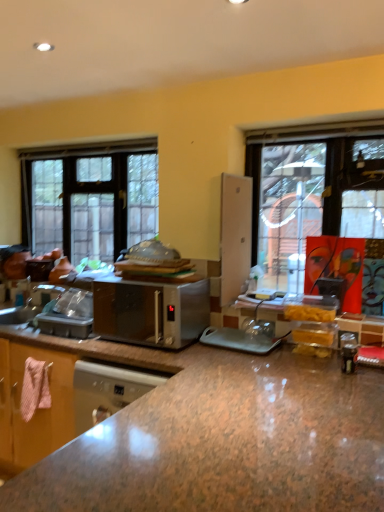
Locate an element on the screen. The image size is (384, 512). clear glass window at left is located at coordinates (90, 197).

From a real-world perspective, is clear glass window at left physically below satin silver microwave at center?

No.

From the image's perspective, is clear glass window at left below satin silver microwave at center?

No.

Is clear glass window at left positioned far away from satin silver microwave at center?

Yes, clear glass window at left and satin silver microwave at center are quite far apart.

Can you tell me how much satin silver microwave at center and clear glass window at left differ in facing direction?

The angle between the facing direction of satin silver microwave at center and the facing direction of clear glass window at left is 1.95 degrees.

Are satin silver microwave at center and clear glass window at left making contact?

There is a gap between satin silver microwave at center and clear glass window at left.

Consider the image. Which is in front, satin silver microwave at center or clear glass window at left?

satin silver microwave at center is closer to the camera.

From a real-world perspective, is satin silver microwave at center physically below clear glass window at left?

Indeed, from a real-world perspective, satin silver microwave at center is positioned beneath clear glass window at left.

Considering the positions of point (334, 436) and point (122, 231), is point (334, 436) closer or farther from the camera than point (122, 231)?

Clearly, point (334, 436) is closer to the camera than point (122, 231).

This screenshot has width=384, height=512. I want to click on countertop on the right of clear glass window at left, so click(218, 436).

Would you say brown granite countertop at center is a long distance from clear glass window at left?

Yes, brown granite countertop at center is far from clear glass window at left.

Considering the sizes of brown granite countertop at center and clear glass window at left in the image, is brown granite countertop at center wider or thinner than clear glass window at left?

In the image, brown granite countertop at center appears to be wider than clear glass window at left.

Does clear glass window at left lie behind brown granite countertop at center?

Yes, it is behind brown granite countertop at center.

Consider the image. From a real-world perspective, is clear glass window at left positioned over brown granite countertop at center based on gravity?

Yes, from a real-world perspective, clear glass window at left is over brown granite countertop at center

Consider the image. Can brown granite countertop at center be found inside clear glass window at left?

No.

Is clear glass window at left positioned with its back to brown granite countertop at center?

clear glass window at left does not have its back to brown granite countertop at center.

Between satin silver microwave at center and brown granite countertop at center, which one has larger width?

With larger width is brown granite countertop at center.

Are satin silver microwave at center and brown granite countertop at center far apart?

satin silver microwave at center is actually quite close to brown granite countertop at center.

Is satin silver microwave at center at the right side of brown granite countertop at center?

In fact, satin silver microwave at center is to the left of brown granite countertop at center.

Is brown granite countertop at center inside satin silver microwave at center?

No, brown granite countertop at center is not inside satin silver microwave at center.

Does point (6, 495) appear closer or farther from the camera than point (139, 290)?

Point (6, 495) appears to be closer to the viewer than point (139, 290).

Is brown granite countertop at center next to satin silver microwave at center and touching it?

No, brown granite countertop at center is not in contact with satin silver microwave at center.

At what (x,y) coordinates should I click in order to perform the action: click on window that appears on the left of satin silver microwave at center. Please return your answer as a coordinate pair (x, y). The width and height of the screenshot is (384, 512). Looking at the image, I should click on (90, 197).

This screenshot has height=512, width=384. In order to click on window behind the satin silver microwave at center in this screenshot , I will do `click(90, 197)`.

Based on their spatial positions, is clear glass window at left or brown granite countertop at center closer to satin silver microwave at center?

brown granite countertop at center lies closer to satin silver microwave at center than the other object.

Estimate the real-world distances between objects in this image. Which object is closer to clear glass window at left, brown granite countertop at center or satin silver microwave at center?

The object closer to clear glass window at left is satin silver microwave at center.

Considering their positions, is brown granite countertop at center positioned closer to satin silver microwave at center than clear glass window at left?

brown granite countertop at center is positioned closer to the anchor satin silver microwave at center.

Estimate the real-world distances between objects in this image. Which object is closer to brown granite countertop at center, satin silver microwave at center or clear glass window at left?

satin silver microwave at center is closer to brown granite countertop at center.

Looking at the image, which one is located closer to clear glass window at left, satin silver microwave at center or brown granite countertop at center?

satin silver microwave at center is closer to clear glass window at left.

Based on the photo, considering their positions, is clear glass window at left positioned further to brown granite countertop at center than satin silver microwave at center?

The object further to brown granite countertop at center is clear glass window at left.

Where is `microwave oven between brown granite countertop at center and clear glass window at left in the front-back direction`? Image resolution: width=384 pixels, height=512 pixels. microwave oven between brown granite countertop at center and clear glass window at left in the front-back direction is located at coordinates click(151, 312).